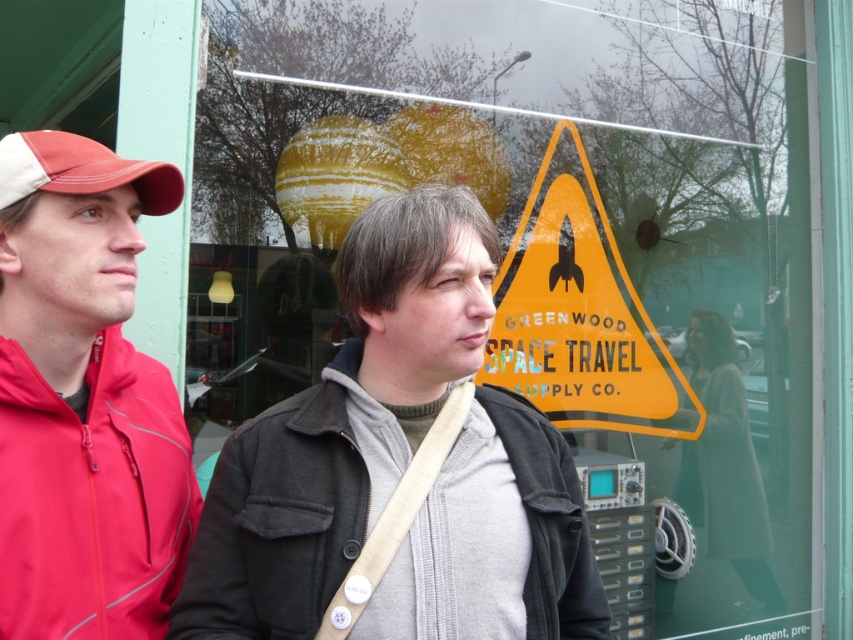
Which is in front, point (405, 513) or point (42, 548)?

Point (42, 548) is in front.

Can you confirm if matte black jacket at center is positioned to the left of red jacket at left?

In fact, matte black jacket at center is to the right of red jacket at left.

Between point (309, 492) and point (49, 413), which one is positioned behind?

Positioned behind is point (309, 492).

The height and width of the screenshot is (640, 853). Identify the location of matte black jacket at center. (292, 435).

Describe the element at coordinates (286, 512) in the screenshot. I see `dark gray cotton jacket at center` at that location.

Is dark gray cotton jacket at center bigger than matte red baseball cap at left?

Correct, dark gray cotton jacket at center is larger in size than matte red baseball cap at left.

What do you see at coordinates (286, 512) in the screenshot?
I see `dark gray cotton jacket at center` at bounding box center [286, 512].

Locate an element on the screen. The width and height of the screenshot is (853, 640). dark gray cotton jacket at center is located at coordinates (286, 512).

Is dark gray cotton jacket at center positioned in front of yellowmaterial/texturewarning sign at center?

Yes, dark gray cotton jacket at center is closer to the viewer.

Does dark gray cotton jacket at center have a greater height compared to yellowmaterial/texturewarning sign at center?

No.

Which is behind, point (415, 568) or point (637, 413)?

The point (637, 413) is more distant.

Where is `dark gray cotton jacket at center`? The height and width of the screenshot is (640, 853). dark gray cotton jacket at center is located at coordinates coord(286,512).